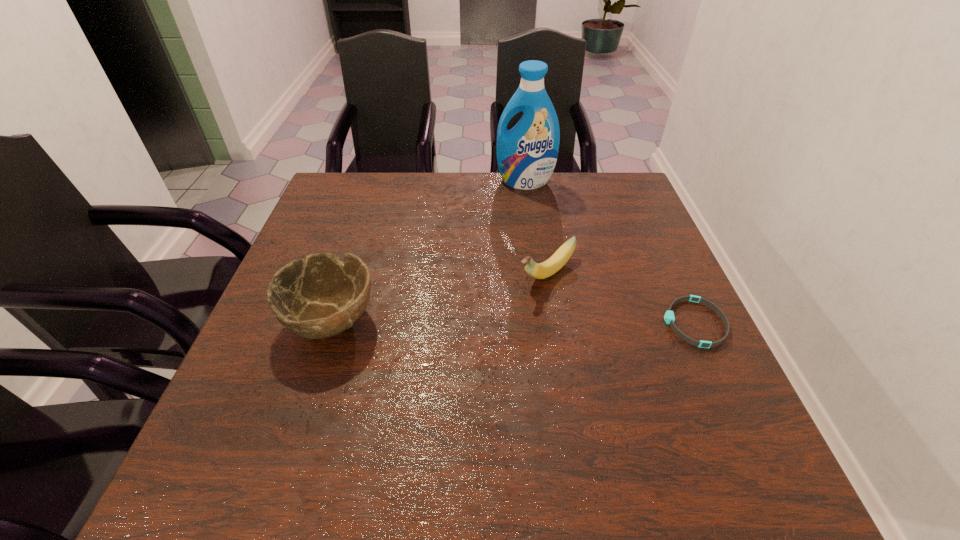
This screenshot has width=960, height=540. I want to click on bowl, so click(319, 297).

The height and width of the screenshot is (540, 960). What are the coordinates of `the shortest object` in the screenshot? It's located at (669, 317).

This screenshot has height=540, width=960. In order to click on the rightmost object in this screenshot , I will do `click(669, 317)`.

The height and width of the screenshot is (540, 960). I want to click on detergent, so click(x=526, y=154).

The width and height of the screenshot is (960, 540). I want to click on the farthest object, so click(x=526, y=154).

Locate an element on the screen. The width and height of the screenshot is (960, 540). banana is located at coordinates (543, 270).

At what (x,y) coordinates should I click in order to perform the action: click on vacant space located on the right of the bowl. Please return your answer as a coordinate pair (x, y). Image resolution: width=960 pixels, height=540 pixels. Looking at the image, I should click on (548, 320).

At what (x,y) coordinates should I click in order to perform the action: click on vacant space situated 0.310m on the buckle of the rightmost object. Please return your answer as a coordinate pair (x, y). This screenshot has height=540, width=960. Looking at the image, I should click on (520, 323).

In order to click on blank space located on the buckle of the rightmost object in this screenshot , I will do `click(525, 323)`.

The image size is (960, 540). Identify the location of vacant space located 0.270m on the buckle of the rightmost object. (539, 323).